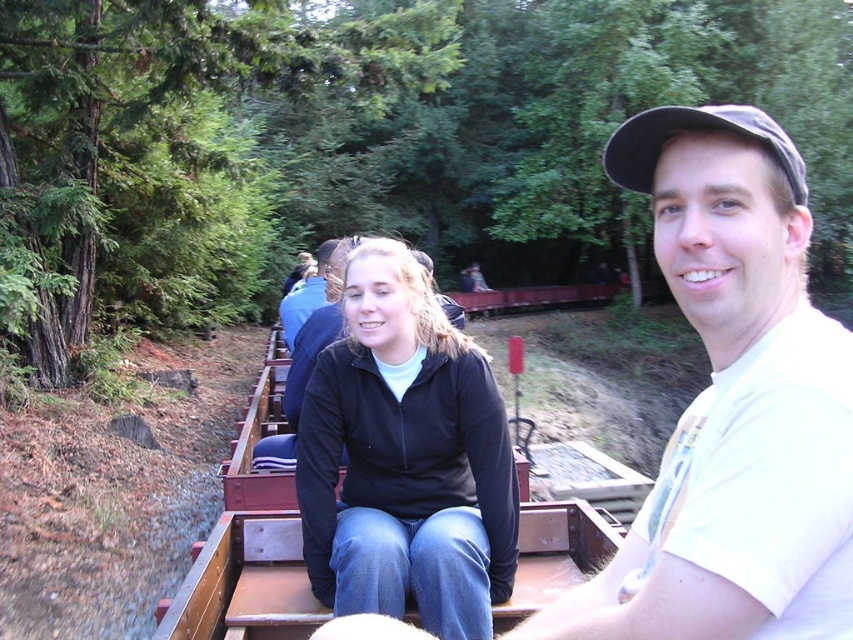
Does point (735, 596) come farther from viewer compared to point (654, 112)?

No, it is in front of (654, 112).

Is white cotton shirt at center to the right of black fabric cap at upper right from the viewer's perspective?

Incorrect, white cotton shirt at center is not on the right side of black fabric cap at upper right.

What do you see at coordinates (732, 404) in the screenshot? The height and width of the screenshot is (640, 853). I see `white cotton shirt at center` at bounding box center [732, 404].

Image resolution: width=853 pixels, height=640 pixels. I want to click on white cotton shirt at center, so click(732, 404).

The height and width of the screenshot is (640, 853). What are the coordinates of `black matte jacket at center` in the screenshot? It's located at (405, 458).

Consider the image. Who is positioned more to the left, white cotton shirt at center or black matte jacket at center?

Positioned to the left is black matte jacket at center.

Based on the photo, does white cotton shirt at center have a lesser height compared to black matte jacket at center?

In fact, white cotton shirt at center may be taller than black matte jacket at center.

Image resolution: width=853 pixels, height=640 pixels. I want to click on white cotton shirt at center, so click(x=732, y=404).